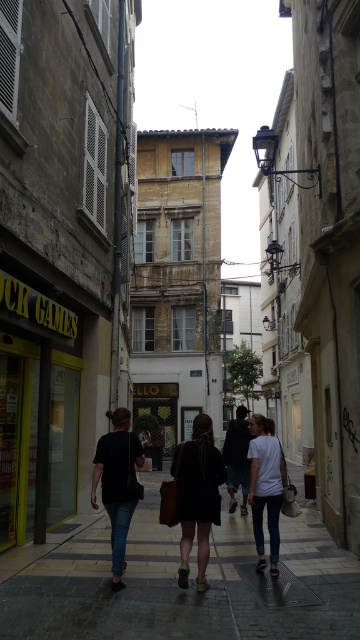
Question: Which object is positioned closest to the white matte t-shirt at center?

Choices:
 (A) dark brown leather jacket at center
 (B) dark gray stone pavement at center

Answer: (A)

Question: In this image, where is dark gray stone pavement at center located relative to white matte t-shirt at center?

Choices:
 (A) below
 (B) above

Answer: (A)

Question: Is black matte shirt at center positioned before white matte t-shirt at center?

Choices:
 (A) yes
 (B) no

Answer: (A)

Question: Which of the following is the closest to the observer?

Choices:
 (A) black matte shirt at center
 (B) dark brown leather jacket at center
 (C) dark gray stone pavement at center
 (D) white matte t-shirt at center

Answer: (C)

Question: Does dark brown leather jacket at center have a lesser width compared to white matte t-shirt at center?

Choices:
 (A) yes
 (B) no

Answer: (B)

Question: Which of the following is the farthest from the observer?

Choices:
 (A) (110, 444)
 (B) (200, 442)
 (C) (272, 492)

Answer: (C)